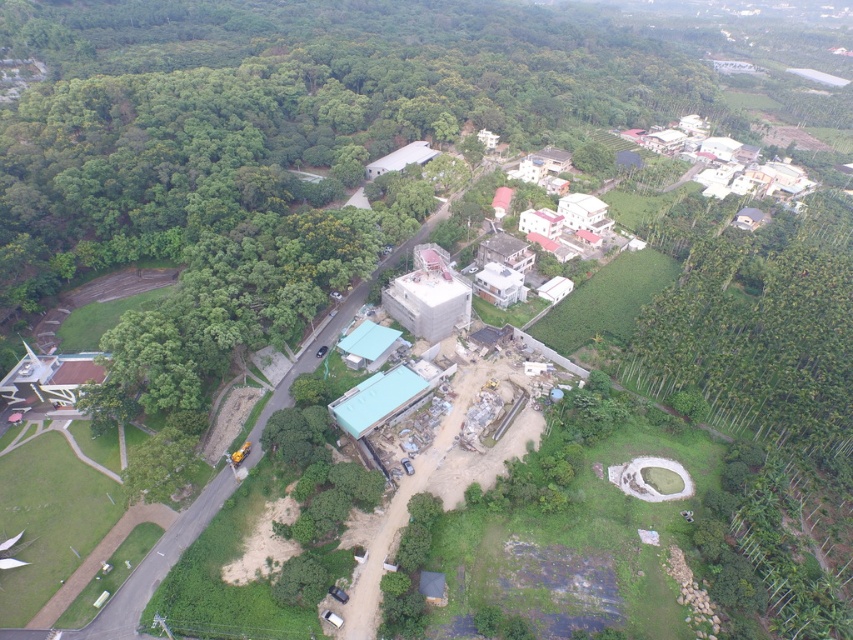
Question: In this image, where is green leafy tree at lower left located relative to green leafy trees at right?

Choices:
 (A) left
 (B) right

Answer: (A)

Question: Which point is farther to the camera?

Choices:
 (A) (3, 168)
 (B) (796, 276)

Answer: (A)

Question: Is green leafy tree at lower left wider than green leafy trees at right?

Choices:
 (A) yes
 (B) no

Answer: (A)

Question: Observing the image, what is the correct spatial positioning of green leafy tree at lower left in reference to green leafy trees at right?

Choices:
 (A) left
 (B) right

Answer: (A)